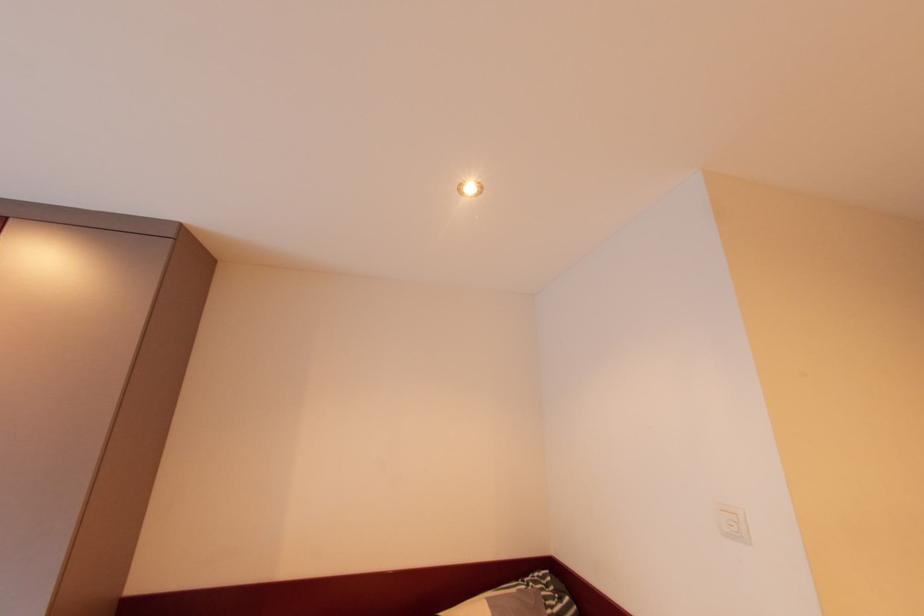
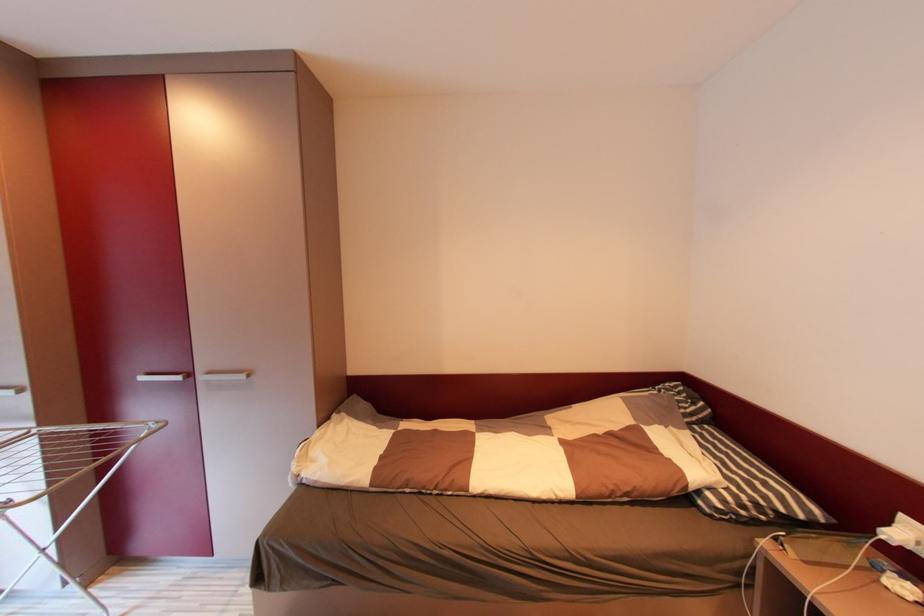
How did the camera likely rotate?

The camera rotated toward left-down.